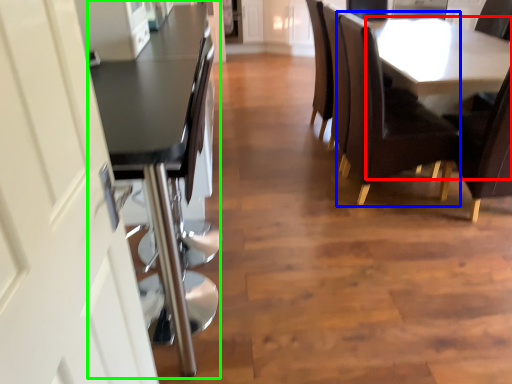
Question: Which is nearer to the table (highlighted by a red box)? chair (highlighted by a blue box) or table (highlighted by a green box).

Choices:
 (A) chair
 (B) table

Answer: (A)